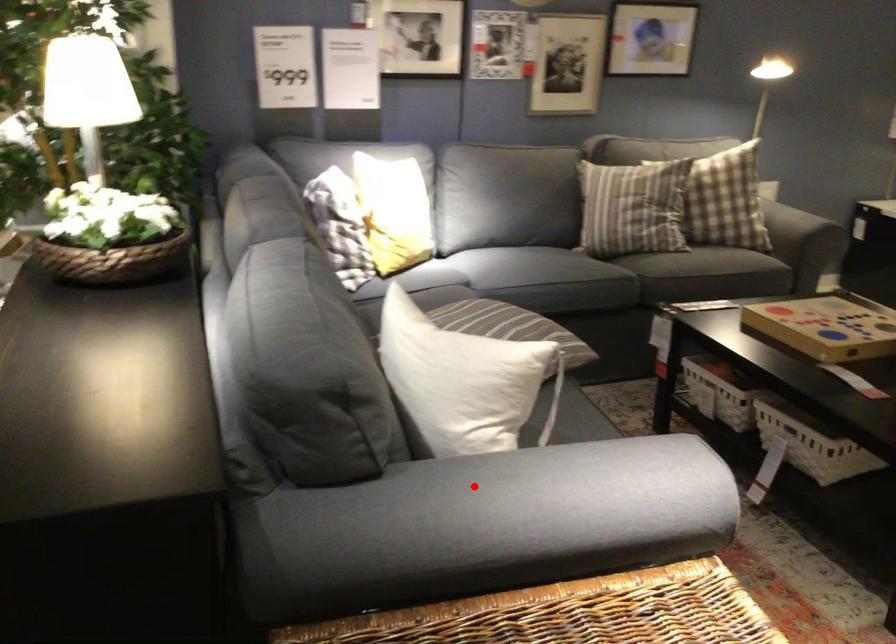
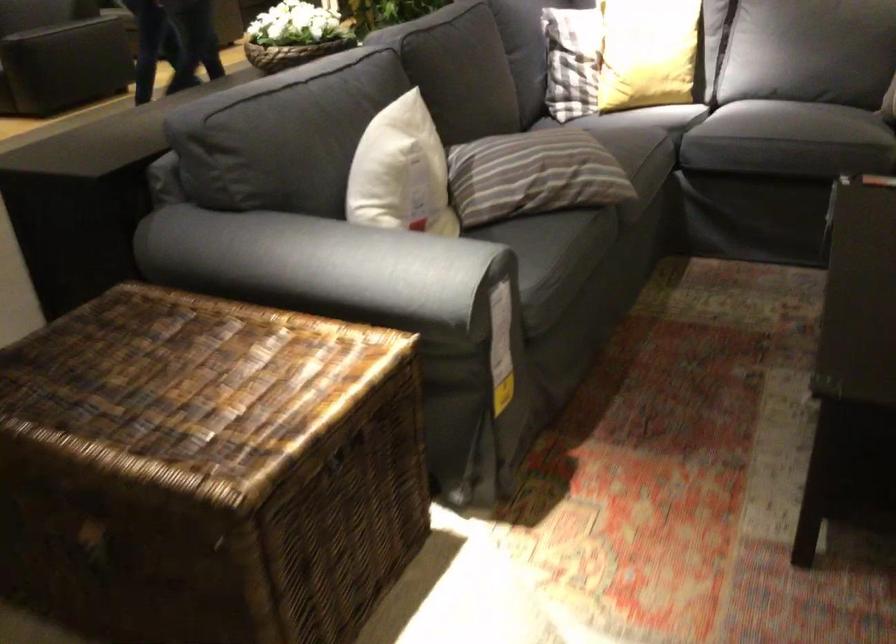
Where in the second image is the point corresponding to the highlighted location from the first image?

(304, 265)